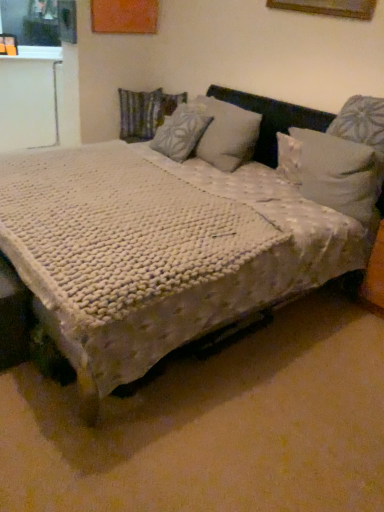
Question: Does white soft pillow at upper right, placed as the 1th pillow when sorted from right to left, have a greater width compared to white textured pillow at center, acting as the 2th pillow starting from the right?

Choices:
 (A) no
 (B) yes

Answer: (A)

Question: Can you confirm if white soft pillow at upper right, which appears as the 1th pillow when viewed from the front, is thinner than white textured pillow at center, the 2th pillow positioned from the front?

Choices:
 (A) no
 (B) yes

Answer: (B)

Question: Is the depth of white soft pillow at upper right, placed as the 3th pillow when sorted from back to front, less than that of white textured pillow at center, the 2th pillow positioned from the front?

Choices:
 (A) no
 (B) yes

Answer: (B)

Question: From a real-world perspective, is white soft pillow at upper right, placed as the 3th pillow when sorted from back to front, over white textured pillow at center, the second pillow viewed from the left?

Choices:
 (A) no
 (B) yes

Answer: (A)

Question: Is white soft pillow at upper right, which ranks as the third pillow in left-to-right order, positioned beyond the bounds of white textured pillow at center, acting as the 2th pillow starting from the right?

Choices:
 (A) yes
 (B) no

Answer: (A)

Question: From the image's perspective, is white textured blanket at center positioned above or below white textured blanket at center?

Choices:
 (A) above
 (B) below

Answer: (B)

Question: Considering their positions, is white textured blanket at center located in front of or behind white textured blanket at center?

Choices:
 (A) front
 (B) behind

Answer: (B)

Question: Is white textured blanket at center situated inside white textured blanket at center or outside?

Choices:
 (A) outside
 (B) inside

Answer: (B)

Question: Considering the positions of white textured blanket at center and white textured blanket at center in the image, is white textured blanket at center wider or thinner than white textured blanket at center?

Choices:
 (A) thin
 (B) wide

Answer: (A)

Question: In terms of height, does white soft pillow at upper right, which ranks as the third pillow in left-to-right order, look taller or shorter compared to white textured blanket at center?

Choices:
 (A) tall
 (B) short

Answer: (B)

Question: Is point (372, 159) closer or farther from the camera than point (382, 203)?

Choices:
 (A) closer
 (B) farther

Answer: (A)

Question: Is white soft pillow at upper right, placed as the 1th pillow when sorted from right to left, wider or thinner than white textured blanket at center?

Choices:
 (A) wide
 (B) thin

Answer: (B)

Question: Is white soft pillow at upper right, which appears as the 1th pillow when viewed from the front, in front of or behind white textured blanket at center in the image?

Choices:
 (A) behind
 (B) front

Answer: (A)

Question: In terms of width, does white textured blanket at center look wider or thinner when compared to white soft pillow at upper right, which appears as the 1th pillow when viewed from the front?

Choices:
 (A) thin
 (B) wide

Answer: (B)

Question: From a real-world perspective, relative to white soft pillow at upper right, placed as the 3th pillow when sorted from back to front, is white textured blanket at center vertically above or below?

Choices:
 (A) above
 (B) below

Answer: (B)